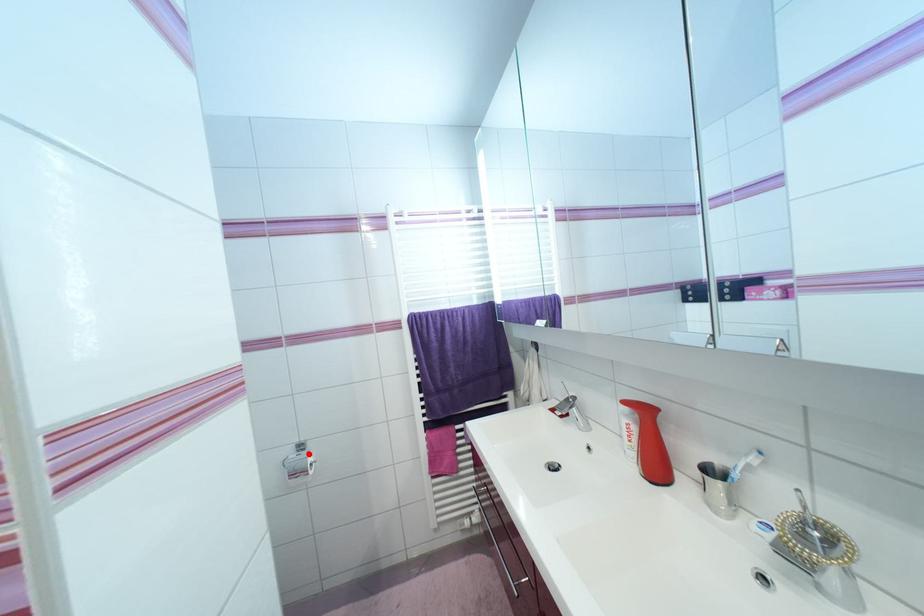
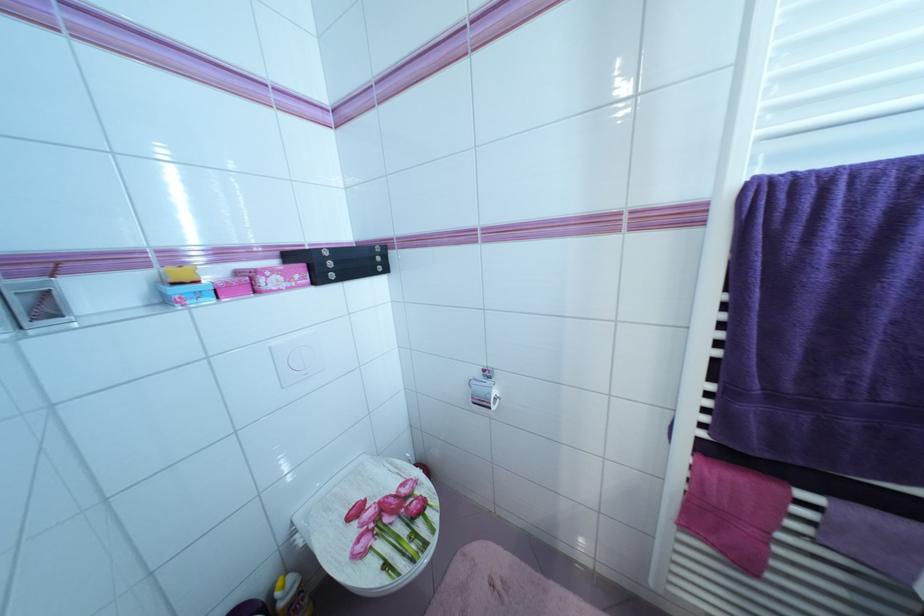
The point at the highlighted location is marked in the first image. Where is the corresponding point in the second image?

(493, 383)